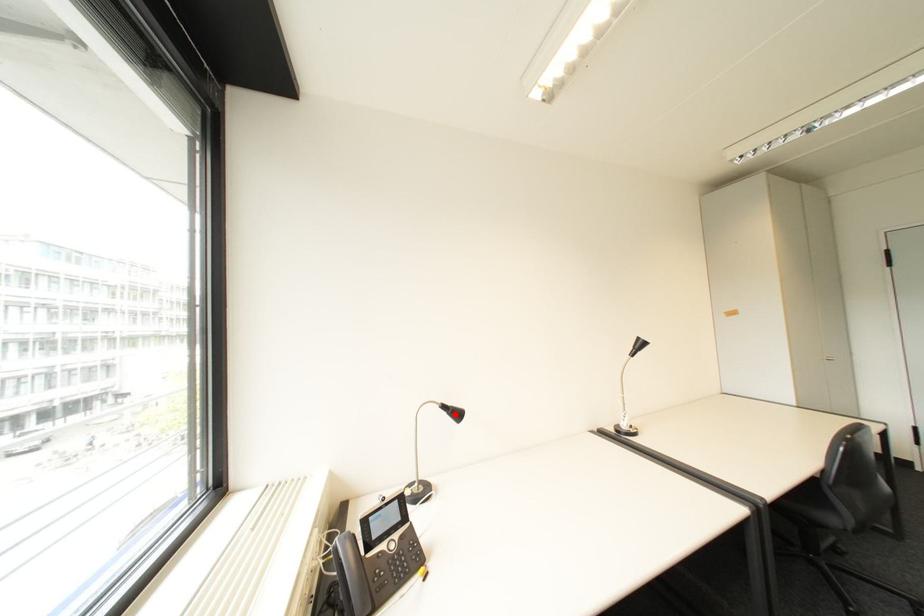
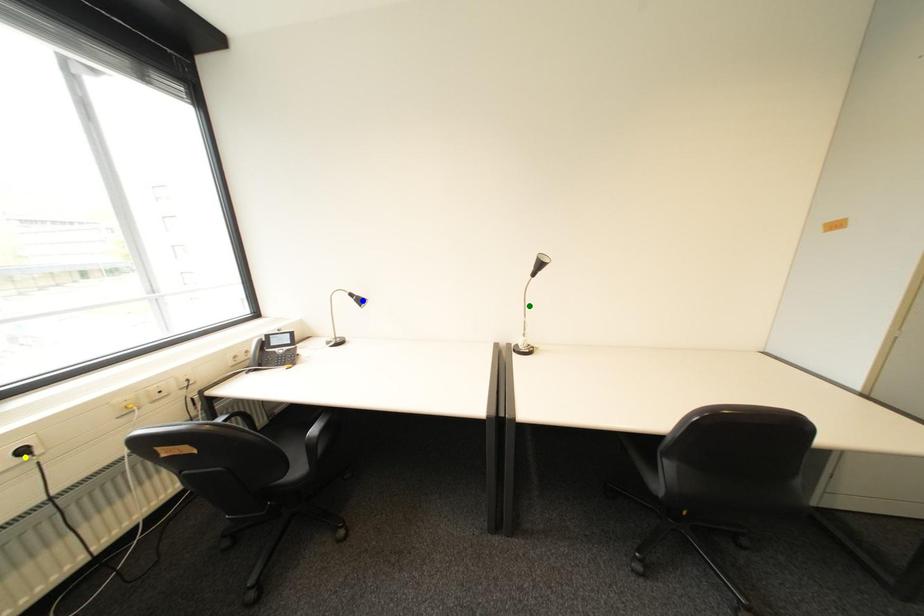
Question: I am providing you with two images of the same scene from different viewpoints. A red point is marked on the first image. You are given multiple points on the second image. In image 2, which mark is for the same physical point as the one in image 1?

Choices:
 (A) green point
 (B) blue point
 (C) yellow point

Answer: (B)